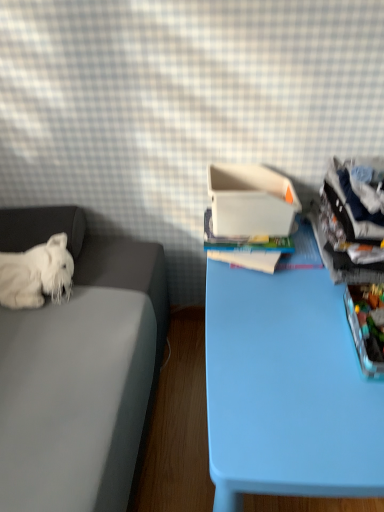
Question: Considering their positions, is white plush dog at left located in front of or behind light blue plastic table at center?

Choices:
 (A) behind
 (B) front

Answer: (A)

Question: In terms of height, does white plush dog at left look taller or shorter compared to light blue plastic table at center?

Choices:
 (A) short
 (B) tall

Answer: (A)

Question: Considering the real-world distances, which object is farthest from the white plush dog at left?

Choices:
 (A) translucent plastic storage box at right
 (B) white plastic container at center
 (C) light blue plastic table at center

Answer: (A)

Question: Estimate the real-world distances between objects in this image. Which object is closer to the white plastic container at center?

Choices:
 (A) translucent plastic storage box at right
 (B) white plush dog at left
 (C) light blue plastic table at center

Answer: (C)